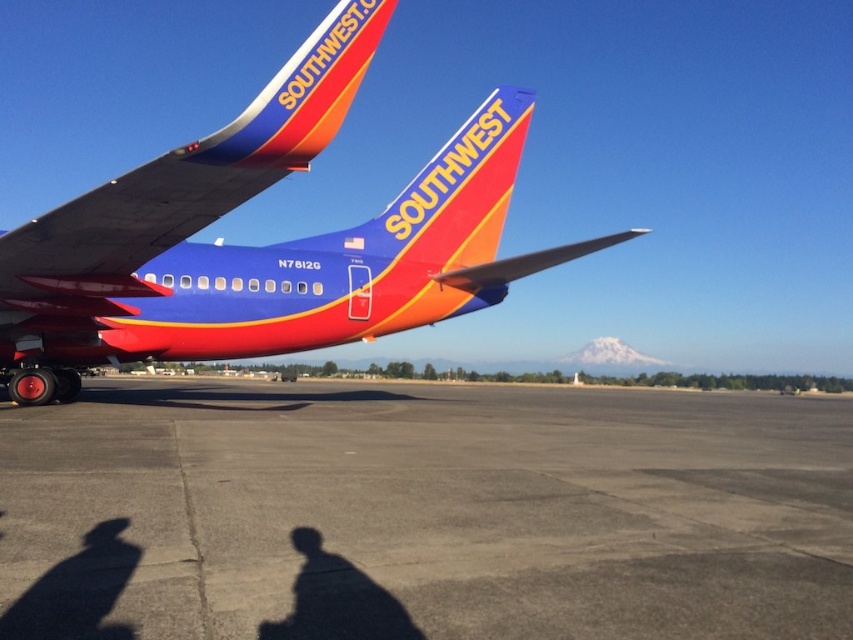
Question: Which object appears farthest from the camera in this image?

Choices:
 (A) matte blue airplane at center
 (B) gray asphalt tarmac at center

Answer: (A)

Question: Does gray asphalt tarmac at center come in front of matte blue airplane at center?

Choices:
 (A) yes
 (B) no

Answer: (A)

Question: Which object appears farthest from the camera in this image?

Choices:
 (A) gray asphalt tarmac at center
 (B) matte blue airplane at center

Answer: (B)

Question: Is gray asphalt tarmac at center above matte blue airplane at center?

Choices:
 (A) no
 (B) yes

Answer: (A)

Question: Is gray asphalt tarmac at center bigger than matte blue airplane at center?

Choices:
 (A) yes
 (B) no

Answer: (B)